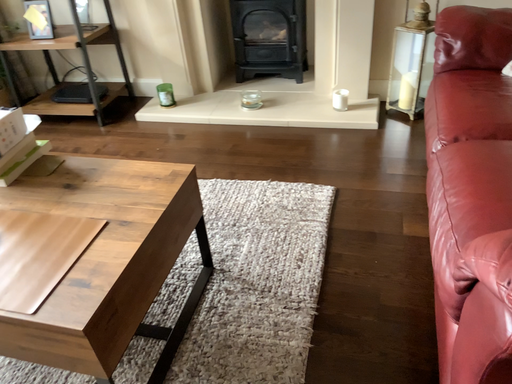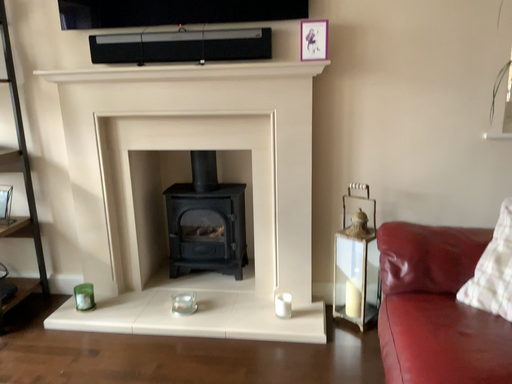
Question: How did the camera likely rotate when shooting the video?

Choices:
 (A) rotated right
 (B) rotated left

Answer: (A)